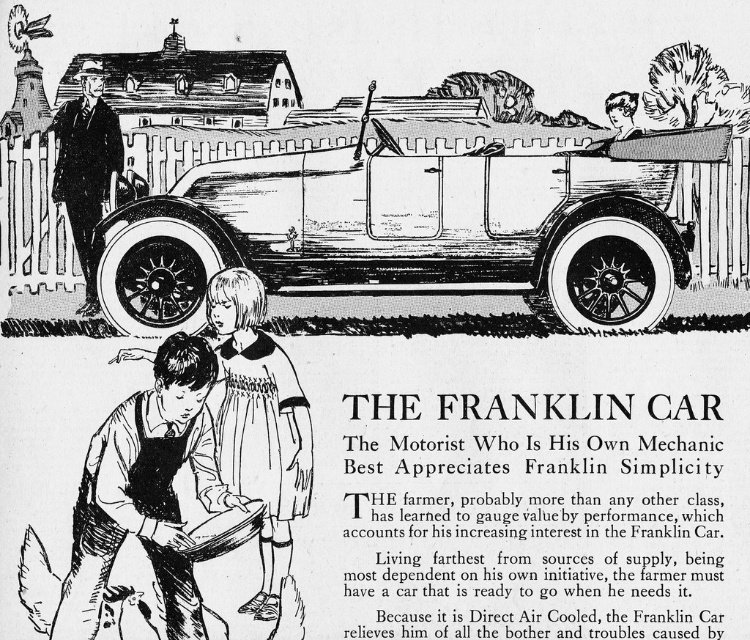
Question: Which of the following is the farthest from the observer?

Choices:
 (A) smooth black shirt at lower left
 (B) dark brown leather vest at lower left

Answer: (A)

Question: Estimate the real-world distances between objects in this image. Which object is closer to the smooth black shirt at lower left?

Choices:
 (A) smooth black suit at left
 (B) silver metallic car at center
 (C) dark brown leather vest at lower left

Answer: (C)

Question: Does silver metallic car at center appear over smooth black suit at left?

Choices:
 (A) yes
 (B) no

Answer: (B)

Question: Can you confirm if silver metallic car at center is positioned to the right of smooth black shirt at lower left?

Choices:
 (A) no
 (B) yes

Answer: (B)

Question: Which point is closer to the camera taking this photo?

Choices:
 (A) (176, 387)
 (B) (501, 236)
 (C) (261, 540)
 (D) (99, 136)

Answer: (A)

Question: Can you confirm if silver metallic car at center is thinner than smooth black shirt at lower left?

Choices:
 (A) yes
 (B) no

Answer: (B)